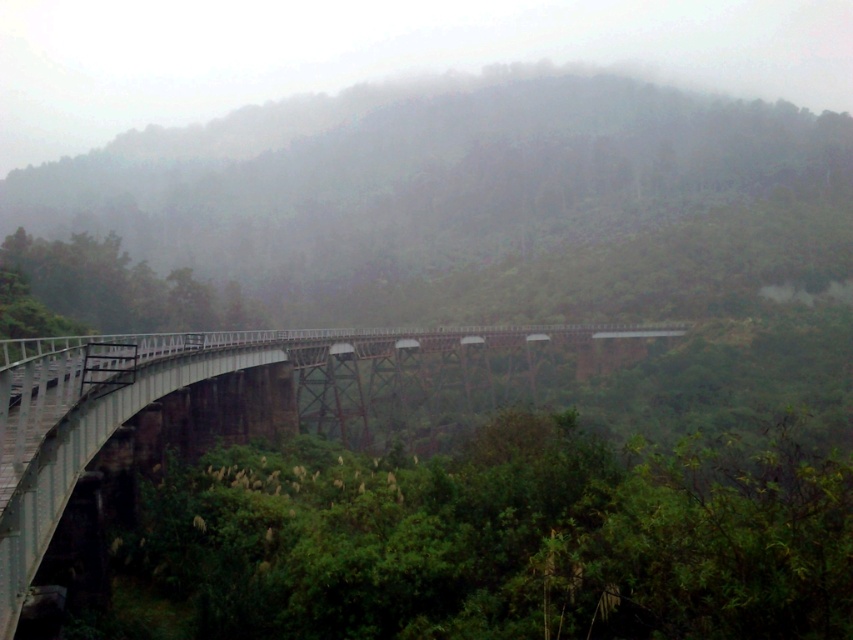
From the picture: You are a landscape photographer planning to capture the white metallic bridge at lower left and the foggy forest at center in a single shot. Based on the scene, which of the two elements occupies a wider area in the image?

The foggy forest at center occupies a wider area in the image as its width is larger than that of the white metallic bridge at lower left.

You are a hiker trying to cross the white metallic bridge at lower left. There is a foggy forest at center blocking your view. Can you see the bridge clearly from where you are standing?

The white metallic bridge at lower left is behind the foggy forest at center, so it is obstructed by the foggy forest at center and cannot be seen clearly from your current position.

You are a hiker planning to cross the white metallic bridge at lower left and then explore the foggy forest at center. Based on the scene, which area will require more time to traverse due to its size?

The foggy forest at center will require more time to traverse because it has a larger size compared to the white metallic bridge at lower left.